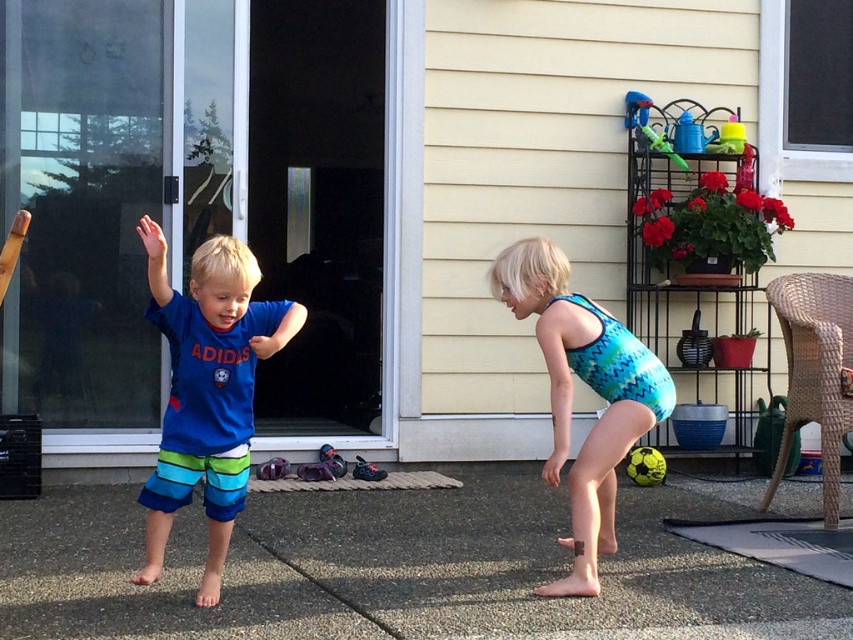
Describe the element at coordinates (207, 390) in the screenshot. I see `blue cotton shirt at left` at that location.

Between blue cotton shirt at left and yellow rubber ball at center, which one is positioned higher?

blue cotton shirt at left

The width and height of the screenshot is (853, 640). Find the location of `blue cotton shirt at left`. blue cotton shirt at left is located at coordinates (207, 390).

Can you confirm if blue cotton shirt at left is positioned to the right of teal zigzag swimsuit at center?

Incorrect, blue cotton shirt at left is not on the right side of teal zigzag swimsuit at center.

The image size is (853, 640). Find the location of `blue cotton shirt at left`. blue cotton shirt at left is located at coordinates (207, 390).

The height and width of the screenshot is (640, 853). I want to click on blue cotton shirt at left, so click(207, 390).

Between transparent glass screen door at center and green plastic watering can at upper right, which one has more height?

Standing taller between the two is transparent glass screen door at center.

Can you confirm if transparent glass screen door at center is positioned to the left of green plastic watering can at upper right?

Correct, you'll find transparent glass screen door at center to the left of green plastic watering can at upper right.

This screenshot has width=853, height=640. Identify the location of transparent glass screen door at center. (318, 205).

Where is `transparent glass screen door at center`? transparent glass screen door at center is located at coordinates (318, 205).